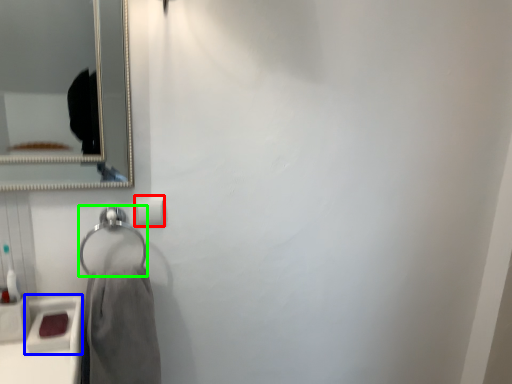
Question: Which object is the farthest from toilet paper (highlighted by a red box)? Choose among these: sink (highlighted by a blue box) or hang (highlighted by a green box).

Choices:
 (A) sink
 (B) hang

Answer: (A)